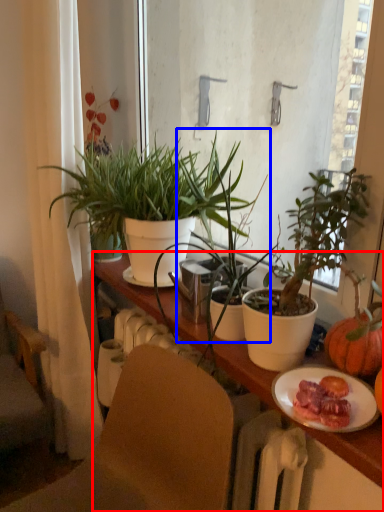
Question: Among these objects, which one is farthest to the camera, cabinetry (highlighted by a red box) or houseplant (highlighted by a blue box)?

Choices:
 (A) cabinetry
 (B) houseplant

Answer: (B)